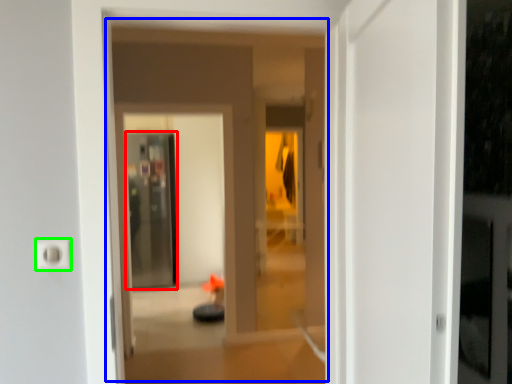
Question: Which object is the farthest from screen door (highlighted by a red box)? Choose among these: hotel lobby (highlighted by a blue box) or electric outlet (highlighted by a green box).

Choices:
 (A) hotel lobby
 (B) electric outlet

Answer: (B)